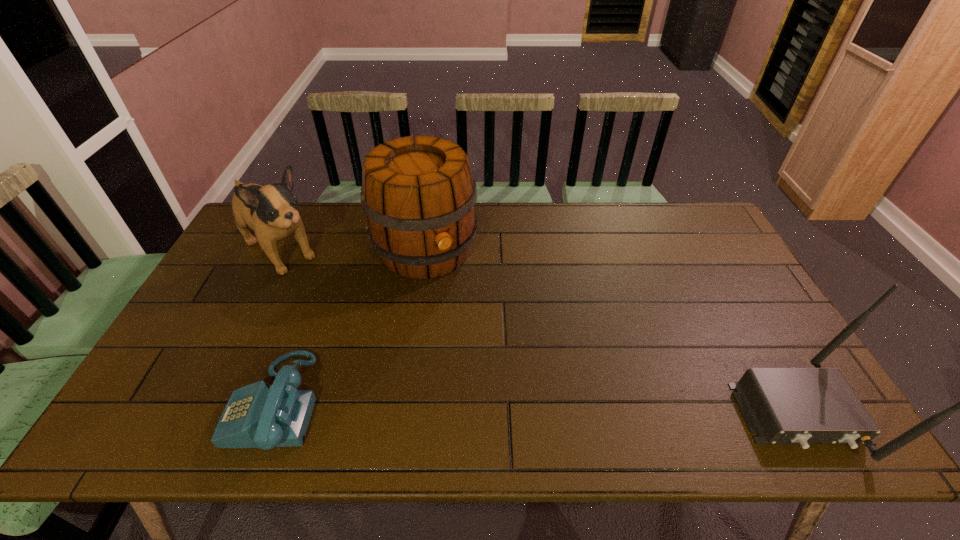
Find the location of a particular element. vacant area between the rightmost object and the telephone is located at coordinates (537, 408).

At what (x,y) coordinates should I click in order to perform the action: click on free space between the third object from left to right and the telephone. Please return your answer as a coordinate pair (x, y). Image resolution: width=960 pixels, height=540 pixels. Looking at the image, I should click on (350, 327).

The image size is (960, 540). I want to click on blank region between the cider and the shortest object, so click(x=350, y=327).

In order to click on free space between the shortest object and the cider in this screenshot , I will do `click(350, 327)`.

Find the location of `blank region between the puppy and the router`. blank region between the puppy and the router is located at coordinates (540, 332).

The height and width of the screenshot is (540, 960). What are the coordinates of `unoccupied area between the puppy and the rightmost object` in the screenshot? It's located at (540, 332).

Select which object appears as the second closest to the telephone. Please provide its 2D coordinates. Your answer should be formatted as a tuple, i.e. [(x, y)], where the tuple contains the x and y coordinates of a point satisfying the conditions above.

[(271, 211)]

At what (x,y) coordinates should I click in order to perform the action: click on the third closest object to the cider. Please return your answer as a coordinate pair (x, y). The height and width of the screenshot is (540, 960). Looking at the image, I should click on (803, 406).

Identify the location of free spot that satisfies the following two spatial constraints: 1. on the front side of the puppy; 2. on the dial of the shortest object. This screenshot has height=540, width=960. (206, 403).